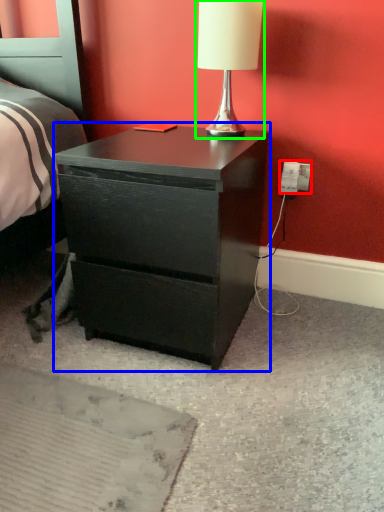
Question: Based on their relative distances, which object is farther from electric outlet (highlighted by a red box)? Choose from nightstand (highlighted by a blue box) and table lamp (highlighted by a green box).

Choices:
 (A) nightstand
 (B) table lamp

Answer: (A)